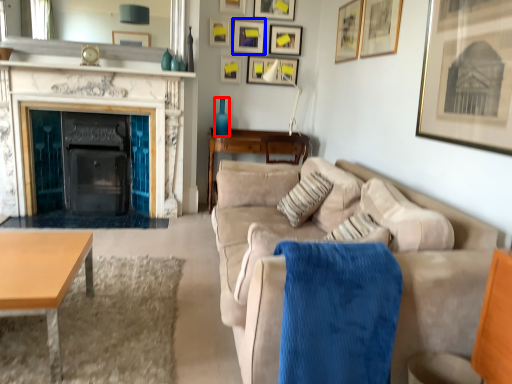
Question: Which object is further to the camera taking this photo, vase (highlighted by a red box) or picture frame (highlighted by a blue box)?

Choices:
 (A) vase
 (B) picture frame

Answer: (B)